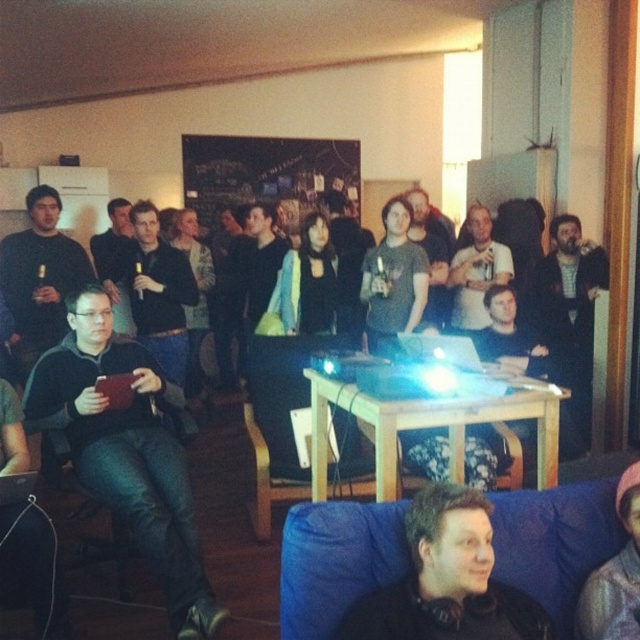
Question: Which of the following is the farthest from the observer?

Choices:
 (A) pink fuzzy hat at lower right
 (B) black leather chair at lower left
 (C) matte black jacket at left
 (D) blue fabric couch at lower right

Answer: (B)

Question: Can you confirm if matte black jacket at left is smaller than pink fuzzy hat at lower right?

Choices:
 (A) no
 (B) yes

Answer: (A)

Question: Can you confirm if matte black jacket at left is bigger than black leather chair at lower left?

Choices:
 (A) no
 (B) yes

Answer: (B)

Question: Does pink fuzzy hat at lower right have a greater width compared to black leather chair at lower left?

Choices:
 (A) no
 (B) yes

Answer: (A)

Question: Which object is positioned closest to the pink fuzzy hat at lower right?

Choices:
 (A) blue fabric couch at lower right
 (B) black leather chair at lower left

Answer: (A)

Question: Which point appears farthest from the camera in this image?

Choices:
 (A) tap(592, 614)
 (B) tap(355, 515)
 (C) tap(122, 518)
 (D) tap(144, 412)

Answer: (D)